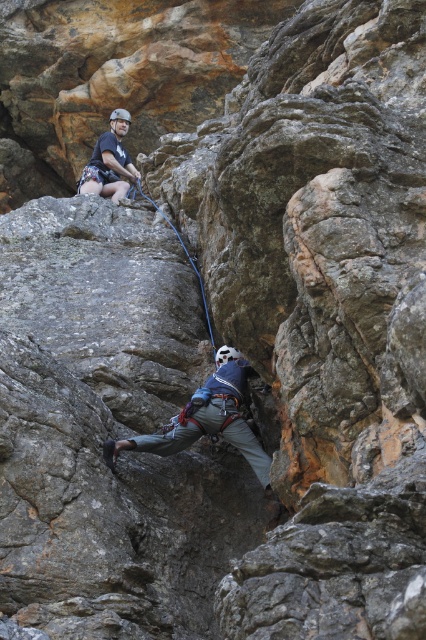
You are a safety inspector assessing the climbing setup. You notice the matte black helmet at upper center and the black rubber rope at center. Which object is positioned closer to the front of the climber?

The matte black helmet at upper center is closer to the front of the climber because the black rubber rope at center is behind it.

You are a safety inspector reviewing the climbing setup. The gray fabric helmet at center and the black rubber rope at center are both critical for safety. Based on their positions, which item is closer to the ground?

The gray fabric helmet at center is below the black rubber rope at center, so the gray fabric helmet at center is closer to the ground.